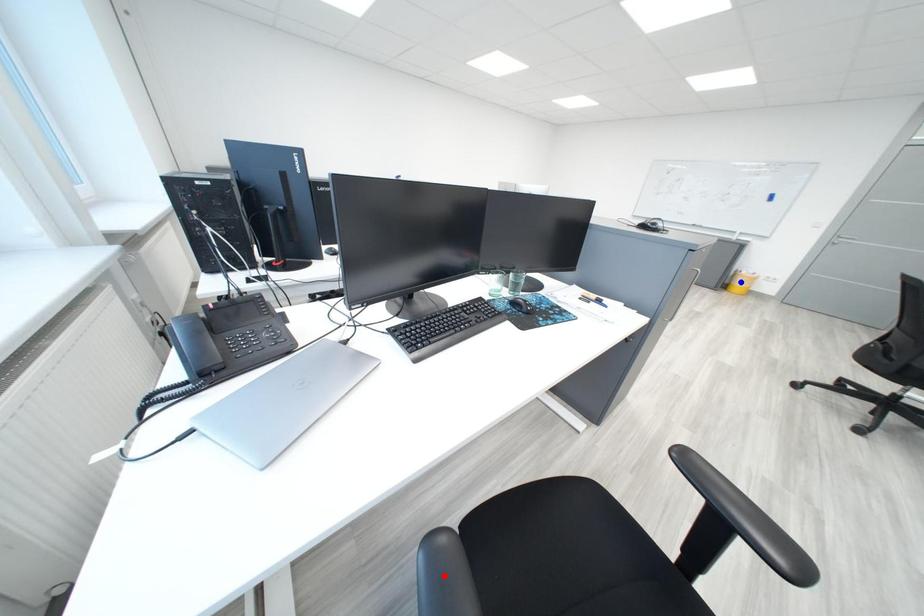
Question: Two points are marked on the image. Which point is closer to the camera?

Choices:
 (A) Blue point is closer.
 (B) Red point is closer.

Answer: (B)